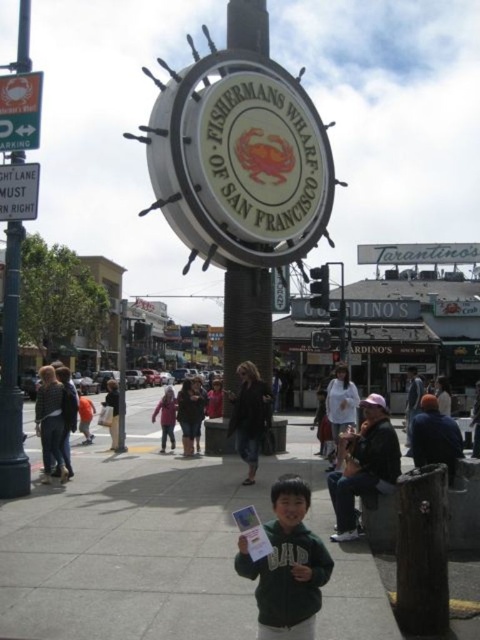
Question: Is the position of blue painted metal pole at left less distant than that of dark blue jeans at lower right?

Choices:
 (A) yes
 (B) no

Answer: (A)

Question: Among these points, which one is nearest to the camera?

Choices:
 (A) [374, 456]
 (B) [75, 588]

Answer: (B)

Question: Does dark blue jacket at lower right have a lesser width compared to dark blue jeans at center?

Choices:
 (A) no
 (B) yes

Answer: (B)

Question: Among these points, which one is farthest from the camera?

Choices:
 (A) (118, 444)
 (B) (252, 372)

Answer: (A)

Question: Among these objects, which one is nearest to the camera?

Choices:
 (A) dark gray sweater at center
 (B) green matte jacket at center
 (C) dark brown leather jacket at center

Answer: (B)

Question: Does blue painted metal pole at left have a lesser width compared to dark gray jacket at lower right?

Choices:
 (A) no
 (B) yes

Answer: (A)